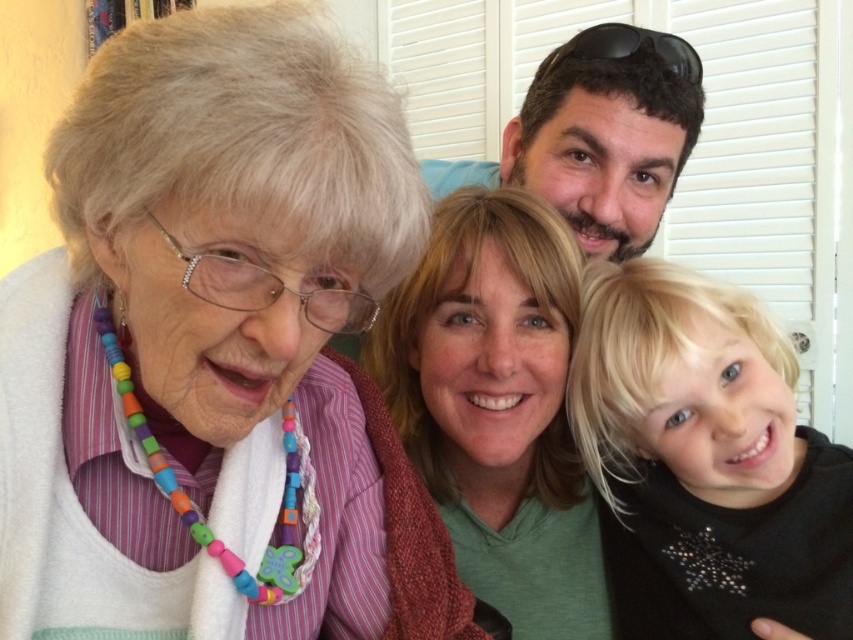
Question: Does blonde hair at lower right have a greater width compared to multicolored beaded necklace at upper left?

Choices:
 (A) no
 (B) yes

Answer: (A)

Question: Is blonde hair at lower right below brown hair at upper center?

Choices:
 (A) no
 (B) yes

Answer: (B)

Question: Which object is positioned closest to the blonde hair at lower right?

Choices:
 (A) white beaded necklace at upper left
 (B) multicolored beaded necklace at upper left

Answer: (B)

Question: Among these points, which one is nearest to the camera?

Choices:
 (A) (775, 499)
 (B) (438, 173)
 (C) (364, 356)
 (D) (165, 115)

Answer: (D)

Question: Is white beaded necklace at upper left positioned behind brown hair at upper center?

Choices:
 (A) yes
 (B) no

Answer: (B)

Question: Which of these objects is positioned closest to the multicolored beaded necklace at upper left?

Choices:
 (A) blonde hair at lower right
 (B) brown hair at upper center

Answer: (A)